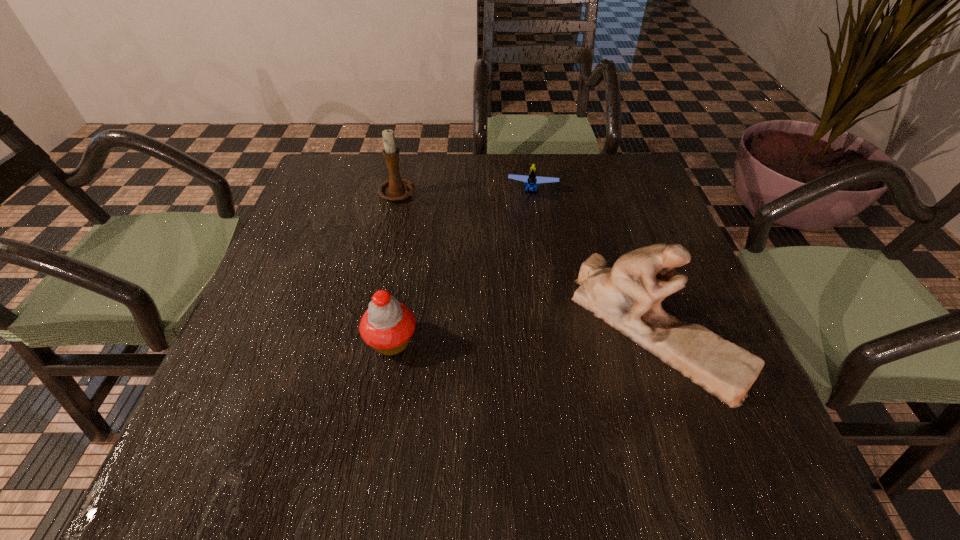
What are the coordinates of `cupcake` in the screenshot? It's located at (387, 325).

Find the location of a particular element. The width and height of the screenshot is (960, 540). figurine is located at coordinates (628, 296).

You are a GUI agent. You are given a task and a screenshot of the screen. Output one action in this format:
    pyautogui.click(x=<x>, y=<y>)
    Task: Click on the shortest object
    The image size is (960, 540).
    Given the screenshot: What is the action you would take?
    pyautogui.click(x=531, y=181)

Find the location of a particular element. Image resolution: width=960 pixels, height=540 pixels. candle holder is located at coordinates (396, 188).

The height and width of the screenshot is (540, 960). Identify the location of vacant position located on the back of the cupcake. (404, 267).

At what (x,y) coordinates should I click in order to perform the action: click on free location located on the front-facing side of the shortest object. Please return your answer as a coordinate pair (x, y). Looking at the image, I should click on (527, 244).

Locate an element on the screen. This screenshot has width=960, height=540. vacant space located 0.200m on the front-facing side of the shortest object is located at coordinates (526, 255).

I want to click on vacant space situated on the front-facing side of the shortest object, so click(x=528, y=233).

Where is `vacant space located 0.360m on the side of the candle holder with the handle`? This screenshot has height=540, width=960. vacant space located 0.360m on the side of the candle holder with the handle is located at coordinates (489, 290).

Locate an element on the screen. This screenshot has width=960, height=540. vacant space located on the side of the candle holder with the handle is located at coordinates (465, 265).